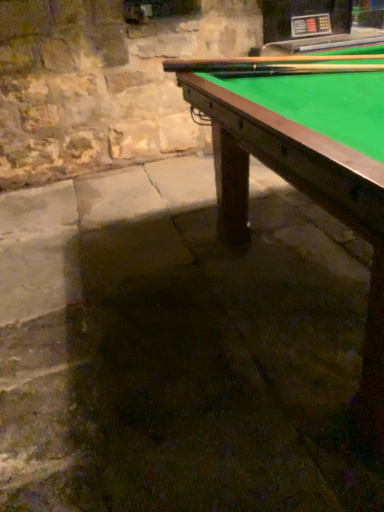
Question: In terms of width, does wooden cue at upper right, marked as the 1th cue in a top-to-bottom arrangement, look wider or thinner when compared to smooth wood cue at upper right, the 2th cue in the top-to-bottom sequence?

Choices:
 (A) thin
 (B) wide

Answer: (B)

Question: From a real-world perspective, is wooden cue at upper right, positioned as the second cue in bottom-to-top order, physically located above or below smooth wood cue at upper right, which is the first cue from bottom to top?

Choices:
 (A) above
 (B) below

Answer: (A)

Question: Which object is positioned farthest from the green felt billiard table at upper right?

Choices:
 (A) smooth wood cue at upper right, the 2th cue in the top-to-bottom sequence
 (B) wooden cue at upper right, marked as the 1th cue in a top-to-bottom arrangement

Answer: (B)

Question: Estimate the real-world distances between objects in this image. Which object is farther from the smooth wood cue at upper right, the 2th cue in the top-to-bottom sequence?

Choices:
 (A) wooden cue at upper right, positioned as the second cue in bottom-to-top order
 (B) green felt billiard table at upper right

Answer: (B)